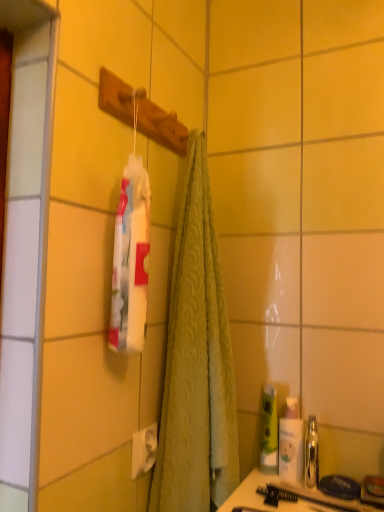
Question: Is matte black comb at lower center taller or shorter than translucent plastic bottle at right?

Choices:
 (A) short
 (B) tall

Answer: (A)

Question: Does point (253, 492) appear closer or farther from the camera than point (286, 404)?

Choices:
 (A) closer
 (B) farther

Answer: (A)

Question: Estimate the real-world distances between objects in this image. Which object is closer to the green matte bottle at lower right, the 1th mouthwash viewed from the left?

Choices:
 (A) shiny metallic mouthwash at right, the 2th mouthwash in the left-to-right sequence
 (B) translucent plastic bottle at right
 (C) matte black comb at lower center

Answer: (B)

Question: Estimate the real-world distances between objects in this image. Which object is closer to the shiny metallic mouthwash at right, the 2th mouthwash in the left-to-right sequence?

Choices:
 (A) green matte bottle at lower right, arranged as the second mouthwash when viewed from the right
 (B) matte black comb at lower center
 (C) translucent plastic bottle at right

Answer: (C)